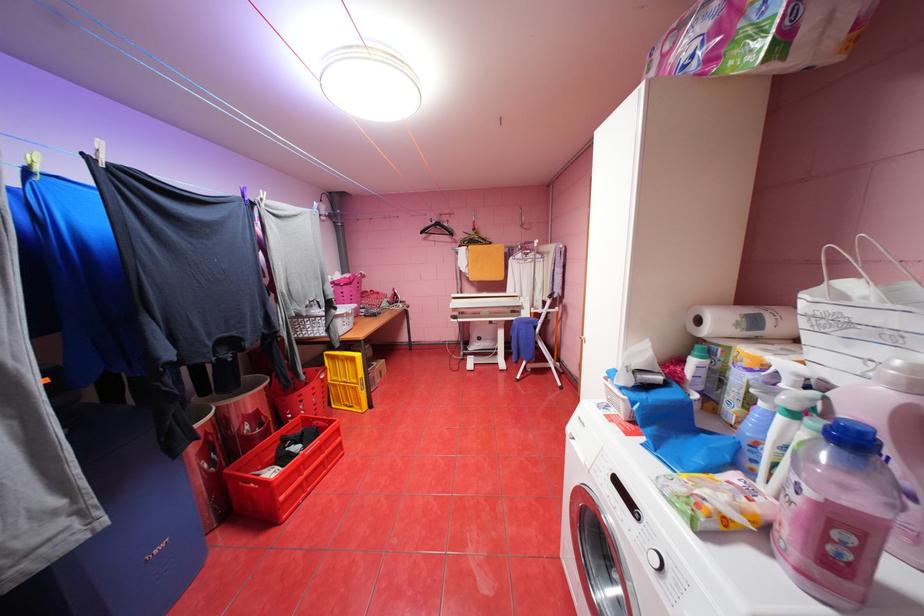
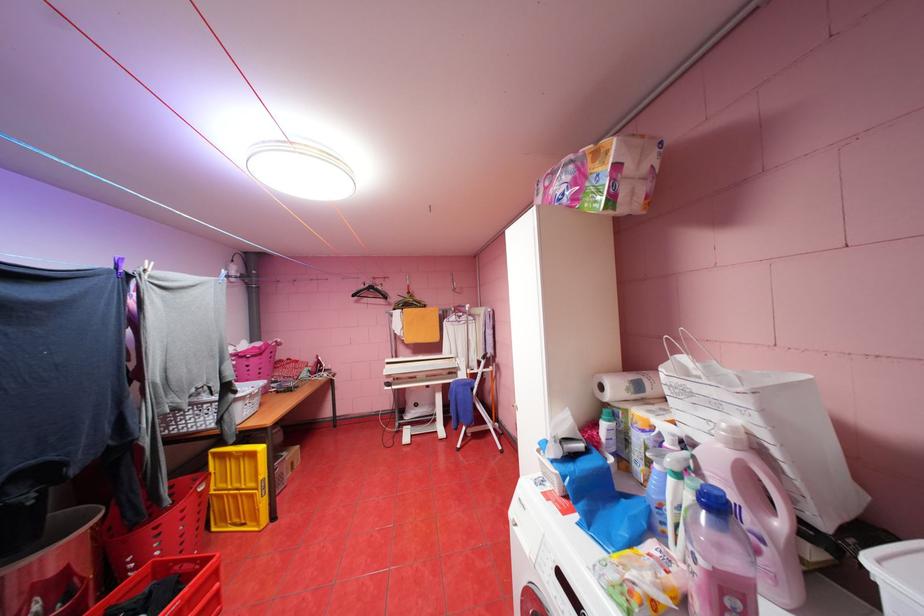
Find the pixel in the second image that matches point (431, 232) in the first image.

(361, 294)